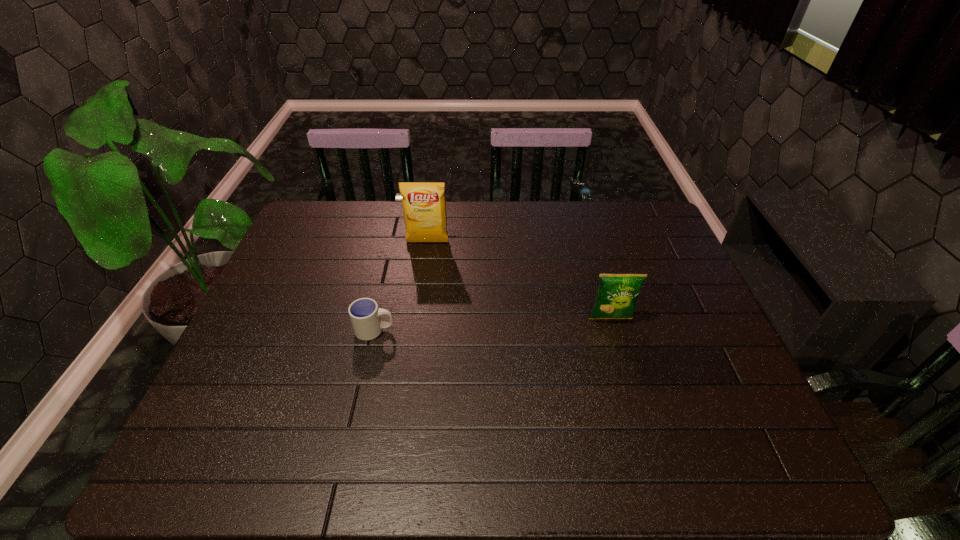
The image size is (960, 540). I want to click on vacant area that lies between the cup and the tallest object, so click(401, 286).

Find the location of a particular element. free area in between the farthest object and the second shortest object is located at coordinates (519, 280).

You are a GUI agent. You are given a task and a screenshot of the screen. Output one action in this format:
    pyautogui.click(x=<x>, y=<y>)
    Task: Click on the blank region between the shortest object and the right crisp (potato chip)
    
    Given the screenshot: What is the action you would take?
    pyautogui.click(x=492, y=325)

Locate an element on the screen. free point between the shorter crisp (potato chip) and the tallest object is located at coordinates (519, 280).

You are a GUI agent. You are given a task and a screenshot of the screen. Output one action in this format:
    pyautogui.click(x=<x>, y=<y>)
    Task: Click on the object that stands as the second closest to the taller crisp (potato chip)
    This screenshot has height=540, width=960.
    Given the screenshot: What is the action you would take?
    pyautogui.click(x=616, y=297)

Select which object appears as the closest to the shorter crisp (potato chip). Please provide its 2D coordinates. Your answer should be formatted as a tuple, i.e. [(x, y)], where the tuple contains the x and y coordinates of a point satisfying the conditions above.

[(424, 206)]

I want to click on free region that satisfies the following two spatial constraints: 1. on the front of the farthest object with the logo; 2. with the handle on the side of the shortest object, so click(x=416, y=330).

Locate an element on the screen. This screenshot has width=960, height=540. free location that satisfies the following two spatial constraints: 1. on the front of the left crisp (potato chip) with the logo; 2. with the handle on the side of the shortest object is located at coordinates (416, 330).

The height and width of the screenshot is (540, 960). I want to click on blank space that satisfies the following two spatial constraints: 1. on the front-facing side of the right crisp (potato chip); 2. with the handle on the side of the shortest object, so click(x=613, y=330).

The width and height of the screenshot is (960, 540). Identify the location of free point that satisfies the following two spatial constraints: 1. on the front-facing side of the shorter crisp (potato chip); 2. with the handle on the side of the shortest object. (613, 330).